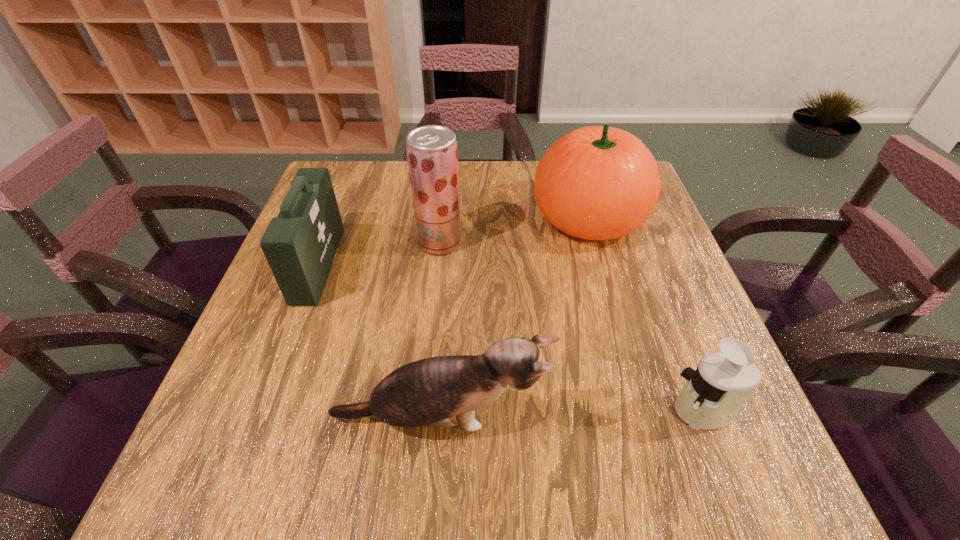
I want to click on object that is positioned at the far edge, so click(x=599, y=183).

At what (x,y) coordinates should I click in order to perform the action: click on object present at the near edge. Please return your answer as a coordinate pair (x, y). This screenshot has width=960, height=540. Looking at the image, I should click on pyautogui.click(x=438, y=391).

The width and height of the screenshot is (960, 540). I want to click on object located at the left edge, so click(x=300, y=244).

The height and width of the screenshot is (540, 960). I want to click on pumpkin present at the right edge, so click(599, 183).

Locate an element on the screen. juicer located in the right edge section of the desktop is located at coordinates (713, 395).

The width and height of the screenshot is (960, 540). In order to click on object positioned at the far right corner in this screenshot , I will do `click(599, 183)`.

In the image, there is a desktop. Find the location of `free region at the far edge`. free region at the far edge is located at coordinates (505, 200).

The image size is (960, 540). In the image, there is a desktop. Identify the location of blank space at the left edge. (334, 294).

Identify the location of free region at the right edge. (651, 239).

Image resolution: width=960 pixels, height=540 pixels. I want to click on vacant area at the far left corner, so click(378, 172).